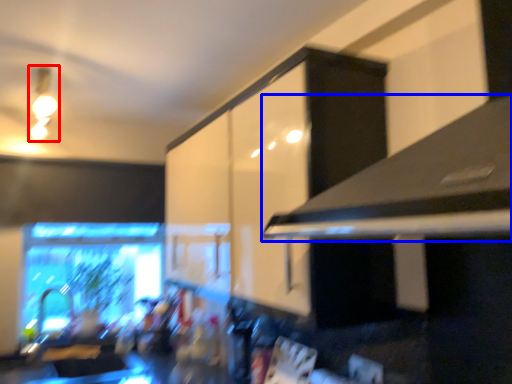
Question: Which object appears closest to the camera in this image, light fixture (highlighted by a red box) or exhaust hood (highlighted by a blue box)?

Choices:
 (A) light fixture
 (B) exhaust hood

Answer: (B)